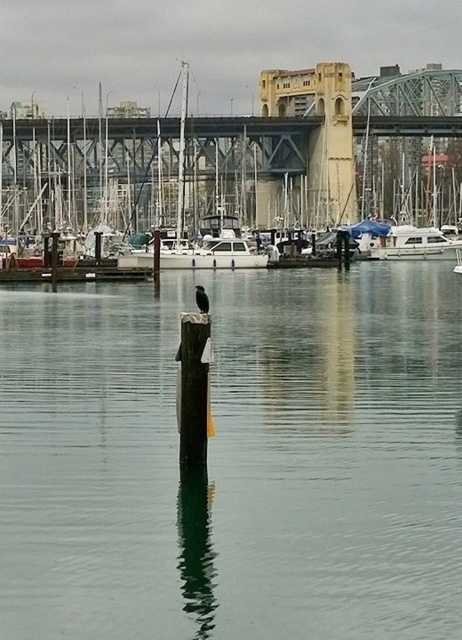
Image resolution: width=462 pixels, height=640 pixels. Describe the element at coordinates (244, 157) in the screenshot. I see `concrete steel bridge at upper center` at that location.

Who is more distant from viewer, (457,100) or (115,260)?

Point (457,100)

Where is `concrete steel bridge at upper center`? The image size is (462, 640). concrete steel bridge at upper center is located at coordinates 244,157.

Can you confirm if white glossy boat at right is positioned to the left of black feathered bird at center?

Incorrect, white glossy boat at right is not on the left side of black feathered bird at center.

Who is taller, white glossy boat at right or black feathered bird at center?

white glossy boat at right

Which is in front, point (395, 237) or point (206, 294)?

Point (206, 294)

I want to click on white glossy boat at right, so coord(413,243).

Is point (376, 401) farther from viewer compared to point (196, 337)?

Yes, it is.

Is green wood post at center closer to camera compared to brown wood post at center?

Yes.

Does point (160, 337) come behind point (206, 419)?

Yes, point (160, 337) is behind point (206, 419).

Where is `green wood post at center`? green wood post at center is located at coordinates (236, 460).